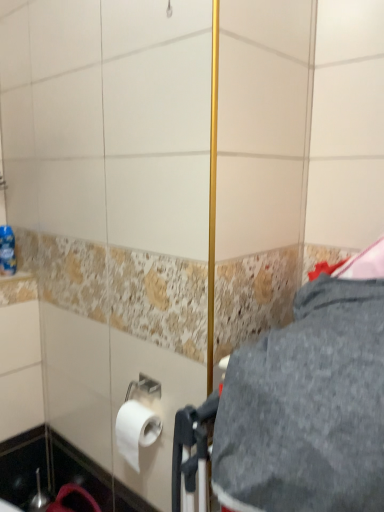
Where is `blue plastic bottle at left`? blue plastic bottle at left is located at coordinates (7, 251).

Where is `white matte toilet paper at lower left`? The width and height of the screenshot is (384, 512). white matte toilet paper at lower left is located at coordinates (135, 430).

Would you say white matte toilet paper at lower left is outside gray fabric at center?

Yes, white matte toilet paper at lower left is outside of gray fabric at center.

Considering the positions of objects white matte toilet paper at lower left and gray fabric at center in the image provided, who is behind, white matte toilet paper at lower left or gray fabric at center?

white matte toilet paper at lower left is behind.

Is white matte toilet paper at lower left placed right next to gray fabric at center?

They are not placed beside each other.

Between blue plastic bottle at left and white matte toilet paper at lower left, which one appears on the left side from the viewer's perspective?

blue plastic bottle at left.

Is blue plastic bottle at left oriented away from white matte toilet paper at lower left?

blue plastic bottle at left does not have its back to white matte toilet paper at lower left.

From a real-world perspective, is blue plastic bottle at left physically above white matte toilet paper at lower left?

Indeed, from a real-world perspective, blue plastic bottle at left stands above white matte toilet paper at lower left.

Between blue plastic bottle at left and white matte toilet paper at lower left, which one has smaller width?

blue plastic bottle at left.

Is gray fabric at center oriented towards blue plastic bottle at left?

No, gray fabric at center is not facing towards blue plastic bottle at left.

Which of these two, gray fabric at center or blue plastic bottle at left, stands shorter?

blue plastic bottle at left.

Can you see gray fabric at center touching blue plastic bottle at left?

No, gray fabric at center is not making contact with blue plastic bottle at left.

Which is more to the right, gray fabric at center or white matte toilet paper at lower left?

From the viewer's perspective, gray fabric at center appears more on the right side.

From a real-world perspective, which is physically below, gray fabric at center or white matte toilet paper at lower left?

white matte toilet paper at lower left.

Which of these two, gray fabric at center or white matte toilet paper at lower left, is bigger?

With larger size is gray fabric at center.

Image resolution: width=384 pixels, height=512 pixels. In order to click on gray above the white matte toilet paper at lower left (from a real-world perspective) in this screenshot , I will do `click(307, 407)`.

From the image's perspective, does white matte toilet paper at lower left appear lower than blue plastic bottle at left?

Yes, from the image's perspective, white matte toilet paper at lower left is below blue plastic bottle at left.

Considering the points (133, 437) and (2, 272), which point is behind, point (133, 437) or point (2, 272)?

Point (2, 272)

Is white matte toilet paper at lower left beside blue plastic bottle at left?

No, white matte toilet paper at lower left is not next to blue plastic bottle at left.

Considering the relative sizes of blue plastic bottle at left and gray fabric at center in the image provided, is blue plastic bottle at left shorter than gray fabric at center?

Yes.

Is blue plastic bottle at left positioned with its back to gray fabric at center?

No, blue plastic bottle at left is not facing away from gray fabric at center.

In the scene shown: Is blue plastic bottle at left wider than gray fabric at center?

No, blue plastic bottle at left is not wider than gray fabric at center.

The image size is (384, 512). Identify the location of toilet paper directly beneath the gray fabric at center (from a real-world perspective). click(135, 430).

At what (x,y) coordinates should I click in order to perform the action: click on toilet paper in front of the blue plastic bottle at left. Please return your answer as a coordinate pair (x, y). Looking at the image, I should click on (135, 430).

When comparing their distances from white matte toilet paper at lower left, does blue plastic bottle at left or gray fabric at center seem further?

Among the two, blue plastic bottle at left is located further to white matte toilet paper at lower left.

Which object lies further to the anchor point blue plastic bottle at left, gray fabric at center or white matte toilet paper at lower left?

gray fabric at center.

From the image, which object appears to be nearer to blue plastic bottle at left, white matte toilet paper at lower left or gray fabric at center?

white matte toilet paper at lower left lies closer to blue plastic bottle at left than the other object.

When comparing their distances from gray fabric at center, does white matte toilet paper at lower left or blue plastic bottle at left seem further?

Among the two, blue plastic bottle at left is located further to gray fabric at center.

Estimate the real-world distances between objects in this image. Which object is further from gray fabric at center, blue plastic bottle at left or white matte toilet paper at lower left?

The object further to gray fabric at center is blue plastic bottle at left.

Looking at the image, which one is located closer to white matte toilet paper at lower left, gray fabric at center or blue plastic bottle at left?

gray fabric at center is closer to white matte toilet paper at lower left.

Image resolution: width=384 pixels, height=512 pixels. In order to click on toilet paper between gray fabric at center and blue plastic bottle at left along the z-axis in this screenshot , I will do `click(135, 430)`.